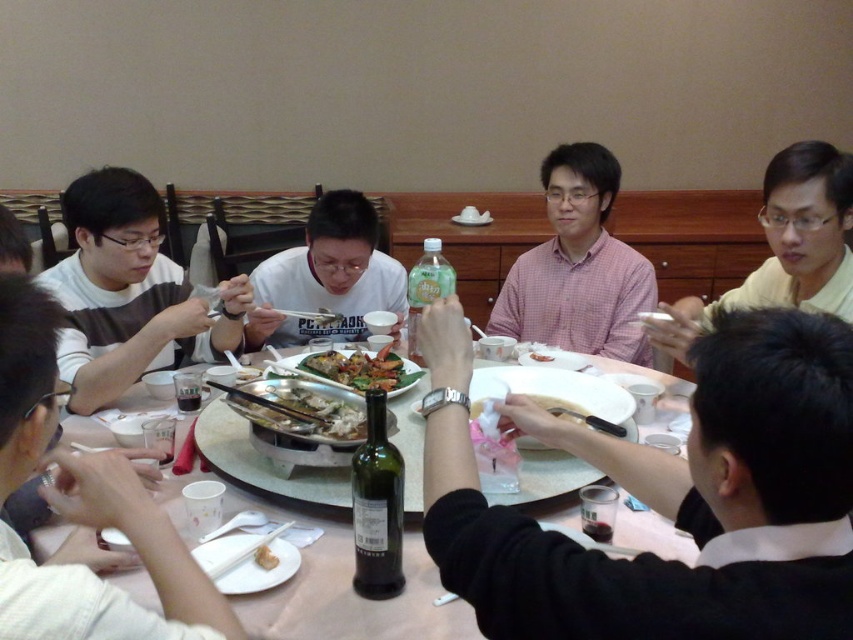
Is white striped sweater at left in front of shiny silver platter at center?

That is False.

The height and width of the screenshot is (640, 853). I want to click on white striped sweater at left, so click(x=129, y=292).

Measure the distance from white striped sweater at left to white plastic chopstick at center.

white striped sweater at left and white plastic chopstick at center are 92.21 centimeters apart from each other.

Identify the location of white striped sweater at left. (129, 292).

Which is in front, point (576, 280) or point (357, 435)?

Positioned in front is point (357, 435).

Consider the image. Is pink checkered shirt at center thinner than shiny silver platter at center?

In fact, pink checkered shirt at center might be wider than shiny silver platter at center.

Describe the element at coordinates (578, 266) in the screenshot. I see `pink checkered shirt at center` at that location.

You are a GUI agent. You are given a task and a screenshot of the screen. Output one action in this format:
    pyautogui.click(x=<x>, y=<y>)
    Task: Click on the pink checkered shirt at center
    
    Given the screenshot: What is the action you would take?
    pyautogui.click(x=578, y=266)